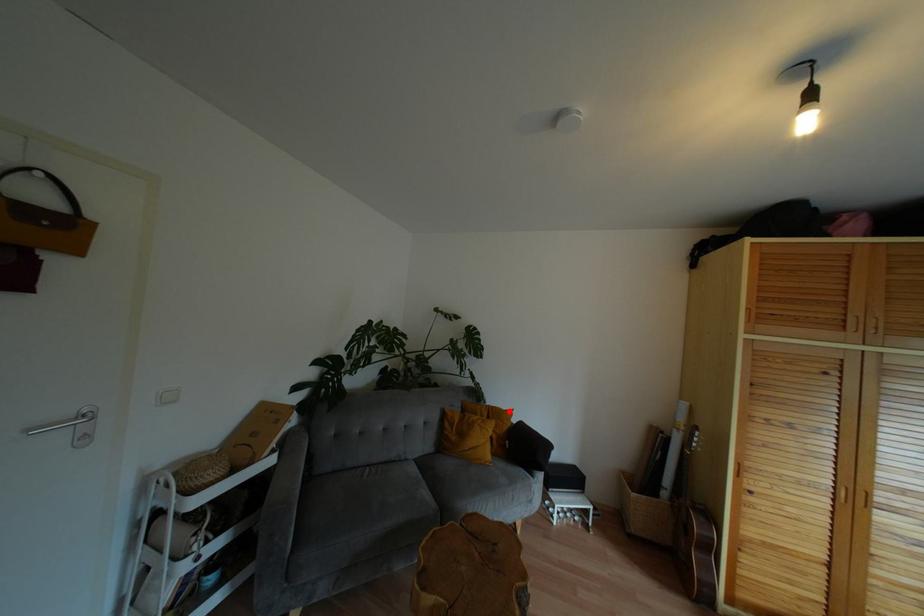
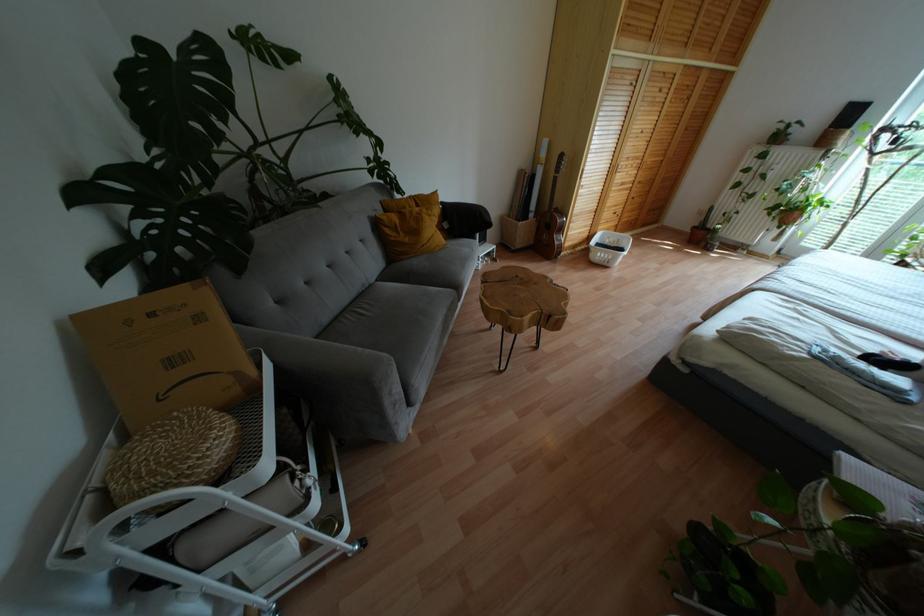
In the second image, find the point that corresponds to the highlighted location in the first image.

(434, 193)